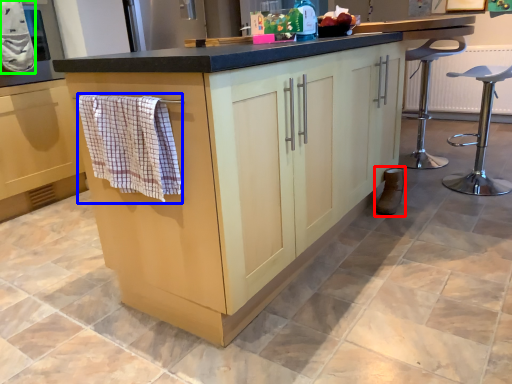
Question: Estimate the real-world distances between objects in this image. Which object is closer to footwear (highlighted by a red box), bath towel (highlighted by a blue box) or bath towel (highlighted by a green box)?

Choices:
 (A) bath towel
 (B) bath towel

Answer: (A)